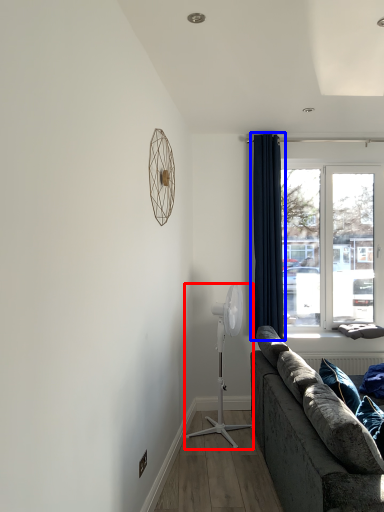
Question: Which object is closer to the camera taking this photo, mechanical fan (highlighted by a red box) or curtain (highlighted by a blue box)?

Choices:
 (A) mechanical fan
 (B) curtain

Answer: (A)